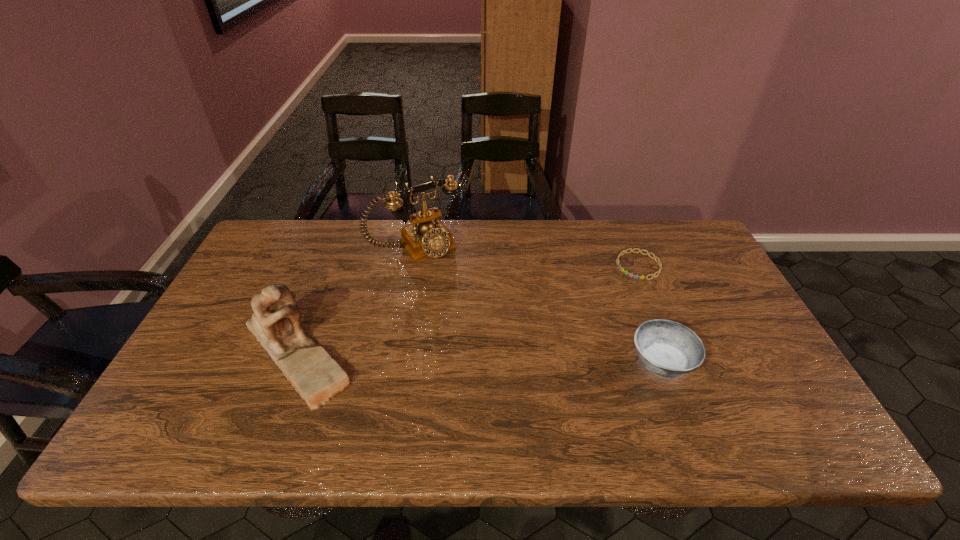
This screenshot has width=960, height=540. I want to click on free space on the desktop that is between the figurine and the ashtray and is positioned on the surface of the bracelet showing star-shaped elements, so click(x=524, y=358).

Find the location of a particular element. This screenshot has width=960, height=540. vacant space on the desktop that is between the figurine and the third tallest object and is positioned on the dial number of the telephone is located at coordinates tap(501, 357).